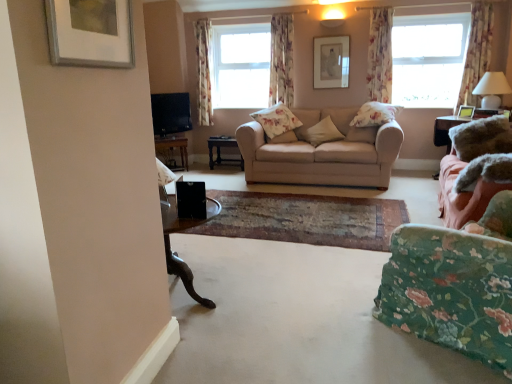
This screenshot has width=512, height=384. Describe the element at coordinates (174, 147) in the screenshot. I see `wooden table at center, arranged as the first table when viewed from the left` at that location.

What do you see at coordinates (454, 285) in the screenshot?
I see `floral fabric chair at lower right` at bounding box center [454, 285].

Measure the distance between dark wood table at center, which is the first table from right to left, and camera.

dark wood table at center, which is the first table from right to left, and camera are 6.18 meters apart.

Find the location of a particular element. The image size is (512, 384). wooden picture frame at upper right, marked as the 2th picture frame in a top-to-bottom arrangement is located at coordinates (466, 111).

What is the approximate height of white fabric window at upper right?

The height of white fabric window at upper right is 3.51 feet.

In order to click on wooden table at center, arranged as the first table when viewed from the left in this screenshot , I will do `click(174, 147)`.

Is beige fabric couch at center, the second studio couch viewed from the front, positioned far away from dark wood table at center, the second table from the left?

Yes, beige fabric couch at center, the second studio couch viewed from the front, and dark wood table at center, the second table from the left, are located far from each other.

Who is smaller, beige fabric couch at center, the second studio couch viewed from the front, or dark wood table at center, which is the first table from right to left?

dark wood table at center, which is the first table from right to left, is smaller.

Does beige fabric couch at center, the second studio couch viewed from the front, have a lesser width compared to dark wood table at center, the second table from the left?

Incorrect, the width of beige fabric couch at center, the second studio couch viewed from the front, is not less than that of dark wood table at center, the second table from the left.

From the image's perspective, is beige fabric couch at center, the 1th studio couch in the back-to-front sequence, beneath dark wood table at center, the second table from the left?

No, from the image's perspective, beige fabric couch at center, the 1th studio couch in the back-to-front sequence, is not below dark wood table at center, the second table from the left.

Visually, is floral fabric pillow at center, which appears as the 2th pillow when viewed from the back, positioned to the left or to the right of white glossy lampshade at right?

In the image, floral fabric pillow at center, which appears as the 2th pillow when viewed from the back, appears on the left side of white glossy lampshade at right.

In terms of height, does floral fabric pillow at center, which is the fourth pillow from front to back, look taller or shorter compared to white glossy lampshade at right?

In the image, floral fabric pillow at center, which is the fourth pillow from front to back, appears to be taller than white glossy lampshade at right.

From a real-world perspective, who is located lower, floral fabric pillow at center, which appears as the 2th pillow when viewed from the back, or white glossy lampshade at right?

floral fabric pillow at center, which appears as the 2th pillow when viewed from the back, from a real-world perspective.

The image size is (512, 384). In order to click on picture frame that is the 1st object located in front of the wooden table at center, which ranks as the 2th table in right-to-left order in this screenshot , I will do `click(331, 62)`.

Between point (330, 78) and point (166, 143), which one is positioned in front?

Positioned in front is point (166, 143).

Does matte white picture frame at upper center, arranged as the first picture frame when viewed from the back, lie in front of wooden table at center, arranged as the first table when viewed from the left?

That is True.

From a real-world perspective, is matte white picture frame at upper center, the 1th picture frame from the top, positioned above or below wooden table at center, which ranks as the 2th table in right-to-left order?

matte white picture frame at upper center, the 1th picture frame from the top, is above wooden table at center, which ranks as the 2th table in right-to-left order.

Is beige fabric couch at center, the 1th studio couch in the back-to-front sequence, at the left side of floral fabric curtain at upper right, which is the first curtain in right-to-left order?

Correct, you'll find beige fabric couch at center, the 1th studio couch in the back-to-front sequence, to the left of floral fabric curtain at upper right, which is the first curtain in right-to-left order.

Between beige fabric couch at center, the second studio couch viewed from the front, and floral fabric curtain at upper right, which ranks as the 4th curtain in left-to-right order, which one has more height?

floral fabric curtain at upper right, which ranks as the 4th curtain in left-to-right order, is taller.

Considering the sizes of objects beige fabric couch at center, the second studio couch viewed from the front, and floral fabric curtain at upper right, which ranks as the 4th curtain in left-to-right order, in the image provided, who is smaller, beige fabric couch at center, the second studio couch viewed from the front, or floral fabric curtain at upper right, which ranks as the 4th curtain in left-to-right order,?

floral fabric curtain at upper right, which ranks as the 4th curtain in left-to-right order, is smaller.

From the image's perspective, which is above, fluffy pink pillow at right, which is the 5th pillow from back to front, or beige fabric pillow at center, placed as the 3th pillow when sorted from back to front?

beige fabric pillow at center, placed as the 3th pillow when sorted from back to front, appears higher in the image.

Which pillow is the 2nd one when counting from the left side of the fluffy pink pillow at right, which is the 1th pillow from front to back? Please provide its 2D coordinates.

[(322, 132)]

Considering the relative sizes of fluffy pink pillow at right, which is the 1th pillow from front to back, and beige fabric pillow at center, the third pillow in the front-to-back sequence, in the image provided, is fluffy pink pillow at right, which is the 1th pillow from front to back, smaller than beige fabric pillow at center, the third pillow in the front-to-back sequence,?

No, fluffy pink pillow at right, which is the 1th pillow from front to back, is not smaller than beige fabric pillow at center, the third pillow in the front-to-back sequence.

From a real-world perspective, is silver metallic picture frame at upper left, which is counted as the 1th picture frame, starting from the bottom, positioned above or below white fabric window at upper right?

From a real-world perspective, silver metallic picture frame at upper left, which is counted as the 1th picture frame, starting from the bottom, is physically above white fabric window at upper right.

Is white fabric window at upper right a part of silver metallic picture frame at upper left, positioned as the third picture frame in back-to-front order?

Definitely not — white fabric window at upper right is not inside silver metallic picture frame at upper left, positioned as the third picture frame in back-to-front order.

Between silver metallic picture frame at upper left, marked as the 3th picture frame in a top-to-bottom arrangement, and white fabric window at upper right, which one has larger width?

Wider between the two is white fabric window at upper right.

Which is in front, silver metallic picture frame at upper left, which ranks as the 1th picture frame in front-to-back order, or white fabric window at upper right?

silver metallic picture frame at upper left, which ranks as the 1th picture frame in front-to-back order, is in front.

Does point (462, 117) appear closer or farther from the camera than point (316, 62)?

Clearly, point (462, 117) is closer to the camera than point (316, 62).

Considering the relative positions of wooden picture frame at upper right, the 3th picture frame from the left, and matte white picture frame at upper center, the 2th picture frame positioned from the left, in the image provided, is wooden picture frame at upper right, the 3th picture frame from the left, to the left or to the right of matte white picture frame at upper center, the 2th picture frame positioned from the left,?

wooden picture frame at upper right, the 3th picture frame from the left, is to the right of matte white picture frame at upper center, the 2th picture frame positioned from the left.

Which of these two, wooden picture frame at upper right, the 3th picture frame from the left, or matte white picture frame at upper center, the 1th picture frame from the top, is bigger?

With larger size is matte white picture frame at upper center, the 1th picture frame from the top.

Can you confirm if wooden picture frame at upper right, acting as the 1th picture frame starting from the right, is taller than matte white picture frame at upper center, the 3th picture frame ordered from the bottom?

No.

From the beige fabric couch at center, the 1th studio couch in the back-to-front sequence, count the 1st table to the left and point to it. Please provide its 2D coordinates.

[(220, 151)]

Locate an element on the screen. lamp lying above the floral fabric pillow at center, which appears as the 2th pillow when viewed from the back (from the image's perspective) is located at coordinates (492, 89).

Which object lies further to the anchor point floral fabric curtain at upper center, which is the 1th curtain from left to right, fluffy pink couch at right, the 1th studio couch positioned from the front, or silver metallic picture frame at upper left, which is counted as the 1th picture frame, starting from the bottom?

silver metallic picture frame at upper left, which is counted as the 1th picture frame, starting from the bottom, is positioned further to the anchor floral fabric curtain at upper center, which is the 1th curtain from left to right.

From the image, which object appears to be nearer to wooden table at center, which ranks as the 2th table in right-to-left order, floral fabric curtain at upper center, which is the 1th curtain from left to right, or fluffy white pillow at center, marked as the first pillow in a back-to-front arrangement?

Based on the image, floral fabric curtain at upper center, which is the 1th curtain from left to right, appears to be nearer to wooden table at center, which ranks as the 2th table in right-to-left order.

Based on their spatial positions, is black plastic speaker at center or white glossy lampshade at right closer to silver metallic picture frame at upper left, positioned as the third picture frame in back-to-front order?

black plastic speaker at center is closer to silver metallic picture frame at upper left, positioned as the third picture frame in back-to-front order.

Considering their positions, is beige fabric pillow at center, the third pillow in the front-to-back sequence, positioned further to fluffy pink pillow at right, which is the 1th pillow from front to back, than wooden picture frame at upper right, positioned as the 2th picture frame in back-to-front order?

wooden picture frame at upper right, positioned as the 2th picture frame in back-to-front order, lies further to fluffy pink pillow at right, which is the 1th pillow from front to back, than the other object.

Looking at the image, which one is located closer to fluffy pink couch at right, which appears as the 2th studio couch when viewed from the back, floral fabric pillow at center, which is the fourth pillow from front to back, or wooden picture frame at upper right, the second picture frame in the front-to-back sequence?

floral fabric pillow at center, which is the fourth pillow from front to back, is positioned closer to the anchor fluffy pink couch at right, which appears as the 2th studio couch when viewed from the back.

Estimate the real-world distances between objects in this image. Which object is closer to silver metallic picture frame at upper left, which ranks as the 1th picture frame in front-to-back order, fluffy pink pillow at right, which is the 5th pillow from back to front, or floral fabric pillow at center, arranged as the 2th pillow when viewed from the front?

Among the two, fluffy pink pillow at right, which is the 5th pillow from back to front, is located nearer to silver metallic picture frame at upper left, which ranks as the 1th picture frame in front-to-back order.

Which object lies further to the anchor point floral fabric pillow at center, which appears as the 2th pillow when viewed from the back, floral fabric curtain at upper right, the 2th curtain when ordered from right to left, or matte white picture frame at upper center, arranged as the first picture frame when viewed from the back?

Based on the image, floral fabric curtain at upper right, the 2th curtain when ordered from right to left, appears to be further to floral fabric pillow at center, which appears as the 2th pillow when viewed from the back.

When comparing their distances from floral fabric curtain at upper right, the 2th curtain when ordered from right to left, does fluffy pink couch at right, which appears as the 2th studio couch when viewed from the back, or floral fabric curtain at center, the 2th curtain in the left-to-right sequence, seem closer?

Among the two, floral fabric curtain at center, the 2th curtain in the left-to-right sequence, is located nearer to floral fabric curtain at upper right, the 2th curtain when ordered from right to left.

Identify the location of curtain between beige fabric pillow at center, the third pillow in the front-to-back sequence, and wooden picture frame at upper right, positioned as the 2th picture frame in back-to-front order, from left to right. (380, 55).

I want to click on studio couch located between fluffy pink pillow at right, which is the 1th pillow from front to back, and white fabric window at upper right in the depth direction, so click(x=323, y=153).

Find the location of a particular element. This screenshot has width=512, height=384. studio couch between floral fabric chair at lower right and beige fabric couch at center, the 1th studio couch in the back-to-front sequence, from front to back is located at coordinates (469, 184).

Find the location of a particular element. This screenshot has width=512, height=384. curtain between floral fabric pillow at center, which appears as the 4th pillow when viewed from the back, and floral fabric curtain at upper right, which is the first curtain in right-to-left order is located at coordinates [x=380, y=55].